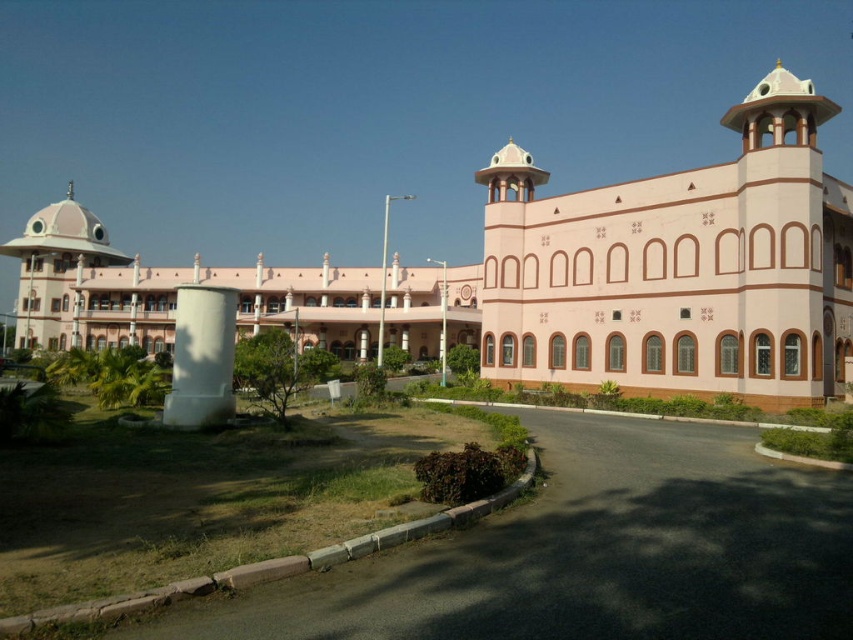
Is pink stone building at center above white smooth pillar at center?

Yes.

Is point (57, 278) more distant than point (223, 310)?

Yes, it is behind point (223, 310).

The image size is (853, 640). What do you see at coordinates (225, 285) in the screenshot?
I see `pink stone building at center` at bounding box center [225, 285].

Locate an element on the screen. The width and height of the screenshot is (853, 640). pink stone building at center is located at coordinates pos(225,285).

Who is positioned more to the left, pink stucco building at center or white smooth pillar at center?

white smooth pillar at center is more to the left.

Does point (578, 232) come closer to viewer compared to point (187, 362)?

No, (578, 232) is further to viewer.

The image size is (853, 640). What are the coordinates of `pink stucco building at center` in the screenshot? It's located at (544, 275).

In the scene shown: Is pink stucco building at center wider than pink stone building at center?

No, pink stucco building at center is not wider than pink stone building at center.

Measure the distance between pink stucco building at center and pink stone building at center.

They are 22.35 feet apart.

Between point (55, 275) and point (45, 224), which one is positioned behind?

Point (45, 224)

Where is `pink stucco building at center`? This screenshot has width=853, height=640. pink stucco building at center is located at coordinates point(544,275).